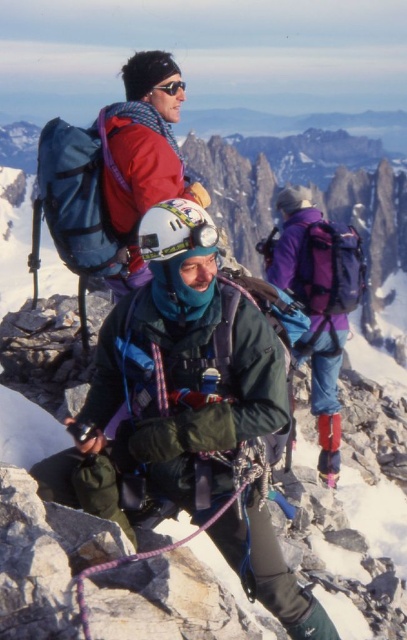
Question: Is green fabric jacket at center bigger than matte black goggles at upper center?

Choices:
 (A) no
 (B) yes

Answer: (B)

Question: Does green fabric jacket at center have a greater width compared to matte black goggles at upper center?

Choices:
 (A) no
 (B) yes

Answer: (B)

Question: Among these objects, which one is farthest from the camera?

Choices:
 (A) matte black goggles at upper center
 (B) green fabric jacket at center

Answer: (A)

Question: Which point appears farthest from the camera in this image?

Choices:
 (A) (111, 387)
 (B) (179, 84)

Answer: (B)

Question: Can you confirm if green fabric jacket at center is positioned to the left of matte black goggles at upper center?

Choices:
 (A) yes
 (B) no

Answer: (A)